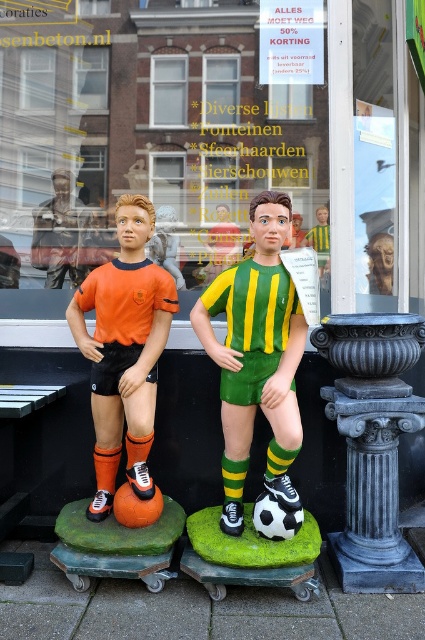
Which is more to the left, matte plastic figurines at center or green/yellow striped jersey at center?

Positioned to the left is matte plastic figurines at center.

Is matte plastic figurines at center behind green/yellow striped jersey at center?

Yes, matte plastic figurines at center is behind green/yellow striped jersey at center.

Does point (192, 100) come farther from viewer compared to point (289, 369)?

Yes, point (192, 100) is farther from viewer.

The height and width of the screenshot is (640, 425). I want to click on matte plastic figurines at center, so click(x=181, y=141).

Which is more to the right, matte plastic figurines at center or orange matte soccer player at left?

matte plastic figurines at center is more to the right.

Is matte plastic figurines at center closer to the viewer compared to orange matte soccer player at left?

No.

Which is in front, point (252, 132) or point (107, 353)?

Positioned in front is point (107, 353).

You are a GUI agent. You are given a task and a screenshot of the screen. Output one action in this format:
    pyautogui.click(x=<x>, y=<y>)
    Task: Click on the matte plastic figurines at center
    This screenshot has width=425, height=640.
    Given the screenshot: What is the action you would take?
    click(181, 141)

Which of these two, green/yellow striped jersey at center or orange matte soccer player at left, stands shorter?

orange matte soccer player at left is shorter.

In the scene shown: Between green/yellow striped jersey at center and orange matte soccer player at left, which one has more height?

green/yellow striped jersey at center

Identify the location of green/yellow striped jersey at center. (257, 356).